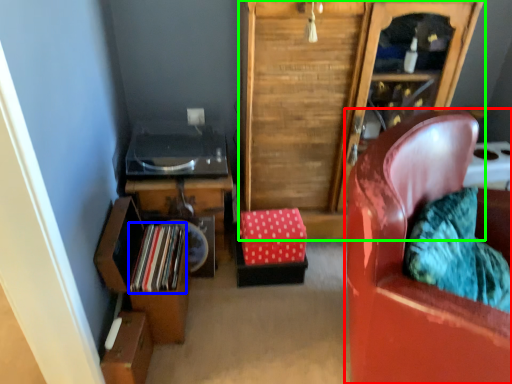
Question: Estimate the real-world distances between objects in this image. Which object is farther from chair (highlighted by a red box), book (highlighted by a blue box) or cabinetry (highlighted by a green box)?

Choices:
 (A) book
 (B) cabinetry

Answer: (A)